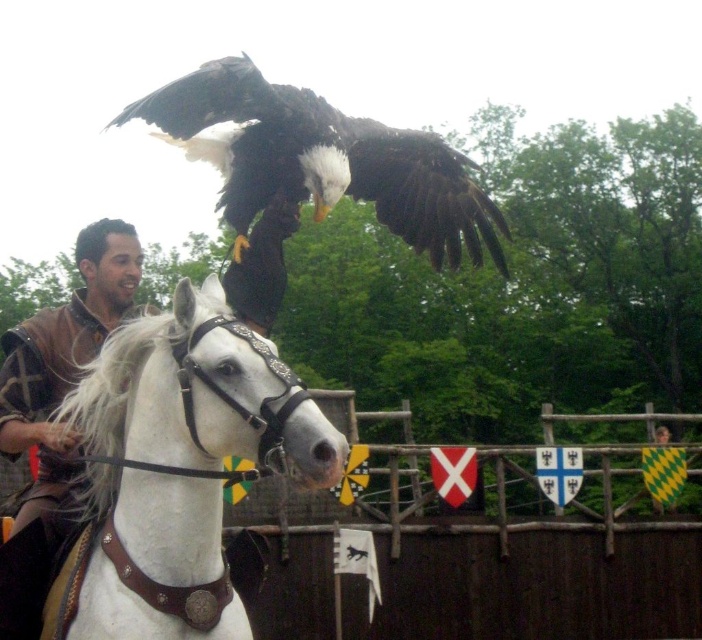
Question: Which point is farther from the camera taking this photo?

Choices:
 (A) (22, 582)
 (B) (62, 340)
 (C) (423, 198)

Answer: (C)

Question: Does white leather horse at center have a greater width compared to dark brown feathers at center?

Choices:
 (A) yes
 (B) no

Answer: (B)

Question: Which of the following is the farthest from the observer?

Choices:
 (A) (84, 378)
 (B) (274, 122)
 (C) (22, 390)

Answer: (B)

Question: Which object is closer to the camera taking this photo?

Choices:
 (A) white leather horse at center
 (B) dark brown feathers at center
 (C) brown leather armor at left

Answer: (A)

Question: Is white leather horse at center below dark brown feathers at center?

Choices:
 (A) yes
 (B) no

Answer: (A)

Question: Does white leather horse at center have a smaller size compared to dark brown feathers at center?

Choices:
 (A) yes
 (B) no

Answer: (A)